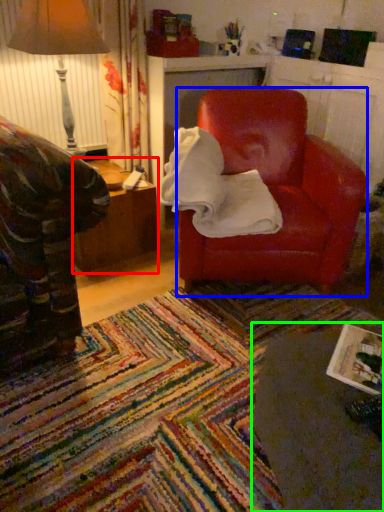
Question: Which object is the closest to the table (highlighted by a red box)? Choose among these: chair (highlighted by a blue box) or table (highlighted by a green box).

Choices:
 (A) chair
 (B) table

Answer: (A)